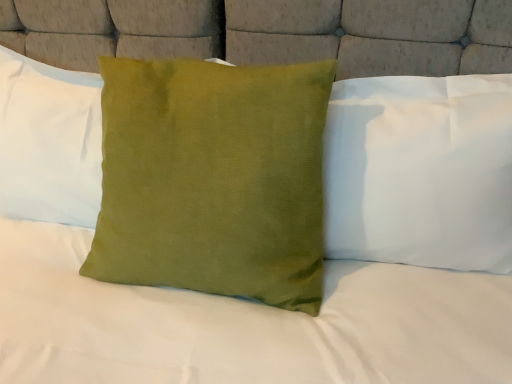
Question: Is point (91, 140) closer or farther from the camera than point (403, 142)?

Choices:
 (A) farther
 (B) closer

Answer: (A)

Question: Looking at the image, does green velvet pillow at center, positioned as the first pillow in left-to-right order, seem bigger or smaller compared to satin green pillow at center, arranged as the third pillow when viewed from the left?

Choices:
 (A) big
 (B) small

Answer: (B)

Question: Which object is the farthest from the green velvet cushion at center, marked as the second pillow in a right-to-left arrangement?

Choices:
 (A) green velvet pillow at center, the 3th pillow when ordered from right to left
 (B) satin green pillow at center, placed as the 1th pillow when sorted from right to left

Answer: (A)

Question: Which of these objects is positioned farthest from the green velvet pillow at center, the 3th pillow when ordered from right to left?

Choices:
 (A) satin green pillow at center, placed as the 1th pillow when sorted from right to left
 (B) green velvet cushion at center, positioned as the 2th pillow in left-to-right order

Answer: (A)